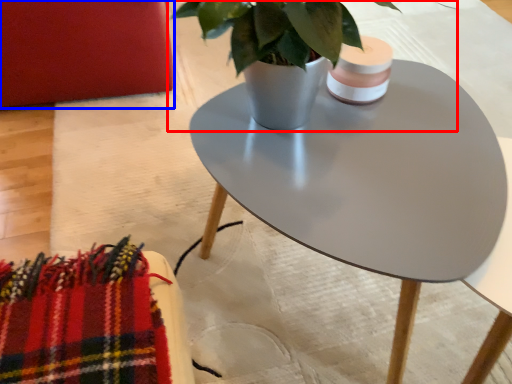
Question: Which point is further to the camera, houseplant (highlighted by a red box) or armchair (highlighted by a blue box)?

Choices:
 (A) houseplant
 (B) armchair

Answer: (B)